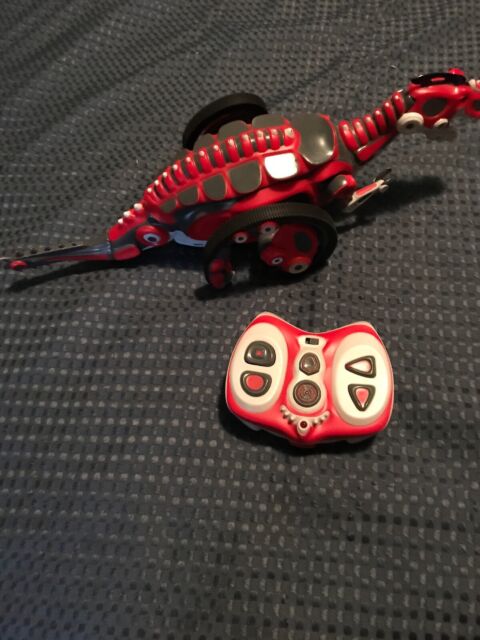
Image resolution: width=480 pixels, height=640 pixels. In order to click on plastic toy in this screenshot , I will do `click(274, 161)`.